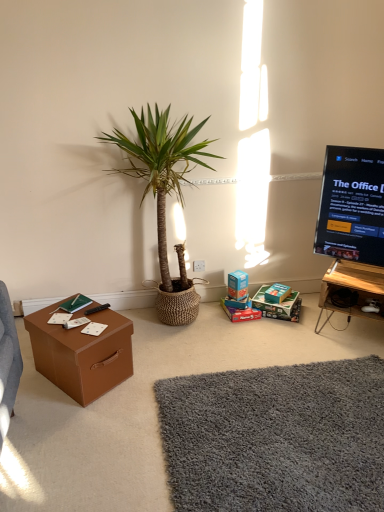
Image resolution: width=384 pixels, height=512 pixels. In order to click on white plastic power outlet at center in this screenshot , I will do `click(198, 266)`.

Describe the element at coordinates (97, 309) in the screenshot. Image resolution: width=384 pixels, height=512 pixels. I see `black plastic remote control at lower left` at that location.

This screenshot has width=384, height=512. What do you see at coordinates (274, 303) in the screenshot?
I see `teal cardboard box at center, the 2th storage box viewed from the left` at bounding box center [274, 303].

In the scene shown: In order to face wooden entertainment center at right, should I rotate leftwards or rightwards?

Turn right approximately 21.459 degrees to face it.

The width and height of the screenshot is (384, 512). What are the coordinates of `white plastic power outlet at center` in the screenshot? It's located at (198, 266).

Looking at this image, is wooden entertainment center at right taller or shorter than black glossy screen at upper right?

wooden entertainment center at right is shorter than black glossy screen at upper right.

Can you confirm if wooden entertainment center at right is thinner than black glossy screen at upper right?

Incorrect, the width of wooden entertainment center at right is not less than that of black glossy screen at upper right.

From the image's perspective, which one is positioned lower, wooden entertainment center at right or black glossy screen at upper right?

wooden entertainment center at right, from the image's perspective.

Based on the photo, is wooden entertainment center at right positioned in front of black glossy screen at upper right?

No, wooden entertainment center at right is further to the viewer.

Relative to white plastic power outlet at center, is wooden entertainment center at right in front or behind?

wooden entertainment center at right is in front of white plastic power outlet at center.

From a real-world perspective, is wooden entertainment center at right physically below white plastic power outlet at center?

Yes, from a real-world perspective, wooden entertainment center at right is below white plastic power outlet at center.

From the picture: Is wooden entertainment center at right not near white plastic power outlet at center?

That's right, there is a large distance between wooden entertainment center at right and white plastic power outlet at center.

Between black plastic remote control at lower left and matte brown storage box at lower right, marked as the 1th storage box in a right-to-left arrangement, which one has smaller size?

With smaller size is black plastic remote control at lower left.

Who is taller, black plastic remote control at lower left or matte brown storage box at lower right, marked as the 1th storage box in a right-to-left arrangement?

With more height is matte brown storage box at lower right, marked as the 1th storage box in a right-to-left arrangement.

Which is more to the left, black plastic remote control at lower left or matte brown storage box at lower right, the 3th storage box from the left?

black plastic remote control at lower left.

From the picture: Is black plastic remote control at lower left positioned beyond the bounds of matte brown storage box at lower right, the 3th storage box from the left?

Indeed, black plastic remote control at lower left is completely outside matte brown storage box at lower right, the 3th storage box from the left.

Is black plastic remote control at lower left at the back of brown cardboard box at lower left?

That's not correct — brown cardboard box at lower left is not looking away from black plastic remote control at lower left.

Which object is closer to the camera taking this photo, brown cardboard box at lower left or black plastic remote control at lower left?

Positioned in front is brown cardboard box at lower left.

Considering the sizes of objects brown cardboard box at lower left and black plastic remote control at lower left in the image provided, who is taller, brown cardboard box at lower left or black plastic remote control at lower left?

brown cardboard box at lower left is taller.

From a real-world perspective, relative to black plastic remote control at lower left, is brown cardboard box at lower left vertically above or below?

Clearly, from a real-world perspective, brown cardboard box at lower left is below black plastic remote control at lower left.

Which of these two, brown cardboard box at lower left or matte cardboard box at lower center, which ranks as the 3th storage box in right-to-left order, is thinner?

Thinner between the two is matte cardboard box at lower center, which ranks as the 3th storage box in right-to-left order.

Is brown cardboard box at lower left inside or outside of matte cardboard box at lower center, which ranks as the 3th storage box in right-to-left order?

brown cardboard box at lower left lies outside matte cardboard box at lower center, which ranks as the 3th storage box in right-to-left order.

Considering the positions of objects brown cardboard box at lower left and matte cardboard box at lower center, the 1th storage box viewed from the left, in the image provided, who is behind, brown cardboard box at lower left or matte cardboard box at lower center, the 1th storage box viewed from the left,?

matte cardboard box at lower center, the 1th storage box viewed from the left, is further away from the camera.

Is matte brown cardboard box at center to the right of matte brown storage box at lower right, marked as the 1th storage box in a right-to-left arrangement, from the viewer's perspective?

No.

How much distance is there between matte brown cardboard box at center and matte brown storage box at lower right, marked as the 1th storage box in a right-to-left arrangement?

The distance of matte brown cardboard box at center from matte brown storage box at lower right, marked as the 1th storage box in a right-to-left arrangement, is 22.79 centimeters.

Does matte brown cardboard box at center turn towards matte brown storage box at lower right, marked as the 1th storage box in a right-to-left arrangement?

No, matte brown cardboard box at center is not facing towards matte brown storage box at lower right, marked as the 1th storage box in a right-to-left arrangement.

Is matte brown cardboard box at center located outside matte brown storage box at lower right, marked as the 1th storage box in a right-to-left arrangement?

Yes.

Between brown cardboard box at lower left and teal cardboard box at center, marked as the 2th storage box in a right-to-left arrangement, which one appears on the left side from the viewer's perspective?

From the viewer's perspective, brown cardboard box at lower left appears more on the left side.

Which of these two, brown cardboard box at lower left or teal cardboard box at center, marked as the 2th storage box in a right-to-left arrangement, stands taller?

With more height is brown cardboard box at lower left.

Can we say brown cardboard box at lower left lies outside teal cardboard box at center, marked as the 2th storage box in a right-to-left arrangement?

brown cardboard box at lower left lies outside teal cardboard box at center, marked as the 2th storage box in a right-to-left arrangement,'s area.

From the image's perspective, which object appears higher, brown cardboard box at lower left or teal cardboard box at center, the 2th storage box viewed from the left?

From the image's view, teal cardboard box at center, the 2th storage box viewed from the left, is above.

Image resolution: width=384 pixels, height=512 pixels. In order to click on television in front of the wooden entertainment center at right in this screenshot , I will do `click(352, 205)`.

Locate an element on the screen. power outlet on the left of the wooden entertainment center at right is located at coordinates (198, 266).

Considering their positions, is green woven pot at center positioned further to matte cardboard box at lower center, the 1th storage box viewed from the left, than matte brown storage box at lower right, marked as the 1th storage box in a right-to-left arrangement?

The object further to matte cardboard box at lower center, the 1th storage box viewed from the left, is green woven pot at center.

Considering their positions, is matte cardboard box at lower center, which ranks as the 3th storage box in right-to-left order, positioned closer to shaggy gray rug at lower center, placed as the 2th plain when sorted from front to back, than teal cardboard box at center, the 2th storage box viewed from the left?

Among the two, matte cardboard box at lower center, which ranks as the 3th storage box in right-to-left order, is located nearer to shaggy gray rug at lower center, placed as the 2th plain when sorted from front to back.

Looking at the image, which one is located closer to shaggy gray rug at lower center, which is the first plain in back-to-front order, matte brown storage box at lower right, marked as the 1th storage box in a right-to-left arrangement, or wooden entertainment center at right?

Among the two, wooden entertainment center at right is located nearer to shaggy gray rug at lower center, which is the first plain in back-to-front order.

Which object lies further to the anchor point teal cardboard box at center, marked as the 2th storage box in a right-to-left arrangement, white plastic power outlet at center or wooden entertainment center at right?

Based on the image, white plastic power outlet at center appears to be further to teal cardboard box at center, marked as the 2th storage box in a right-to-left arrangement.

Estimate the real-world distances between objects in this image. Which object is further from brown cardboard box at lower left, which is counted as the second plain, starting from the back, wooden entertainment center at right or white plastic power outlet at center?

Among the two, white plastic power outlet at center is located further to brown cardboard box at lower left, which is counted as the second plain, starting from the back.

When comparing their distances from teal cardboard box at center, the 2th storage box viewed from the left, does black plastic remote control at lower left or white plastic power outlet at center seem closer?

white plastic power outlet at center.

Looking at the image, which one is located closer to brown cardboard box at lower left, white plastic power outlet at center or black plastic remote control at lower left?

black plastic remote control at lower left.

Considering their positions, is matte brown cardboard box at center positioned further to black glossy screen at upper right than brown cardboard box at lower left?

brown cardboard box at lower left lies further to black glossy screen at upper right than the other object.

This screenshot has width=384, height=512. Identify the location of storage box between matte cardboard box at lower center, the 1th storage box viewed from the left, and matte brown storage box at lower right, marked as the 1th storage box in a right-to-left arrangement, in the horizontal direction. (274, 303).

This screenshot has width=384, height=512. I want to click on cardboard box between white plastic power outlet at center and matte cardboard box at lower center, the 1th storage box viewed from the left, in the horizontal direction, so click(237, 285).

This screenshot has height=512, width=384. Identify the location of remote control between brown cardboard box at lower left, which is counted as the second plain, starting from the back, and matte brown storage box at lower right, marked as the 1th storage box in a right-to-left arrangement, in the front-back direction. (97, 309).

At what (x,y) coordinates should I click in order to perform the action: click on cardboard box located between black plastic remote control at lower left and matte cardboard box at lower center, the 1th storage box viewed from the left, in the left-right direction. Please return your answer as a coordinate pair (x, y). The width and height of the screenshot is (384, 512). Looking at the image, I should click on (237, 285).